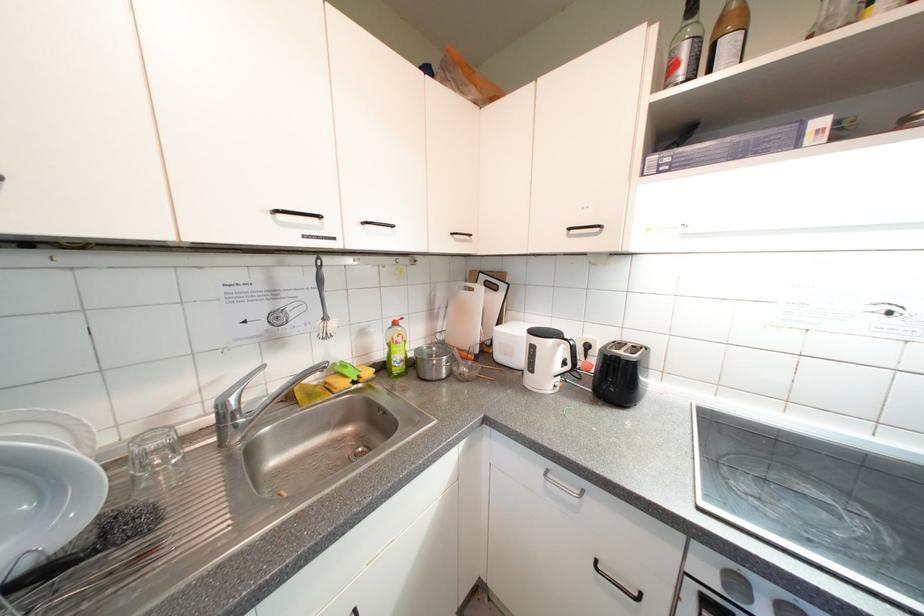
Where would you lift the green soap bottle? Please return your answer as a coordinate pair (x, y).

(395, 350)